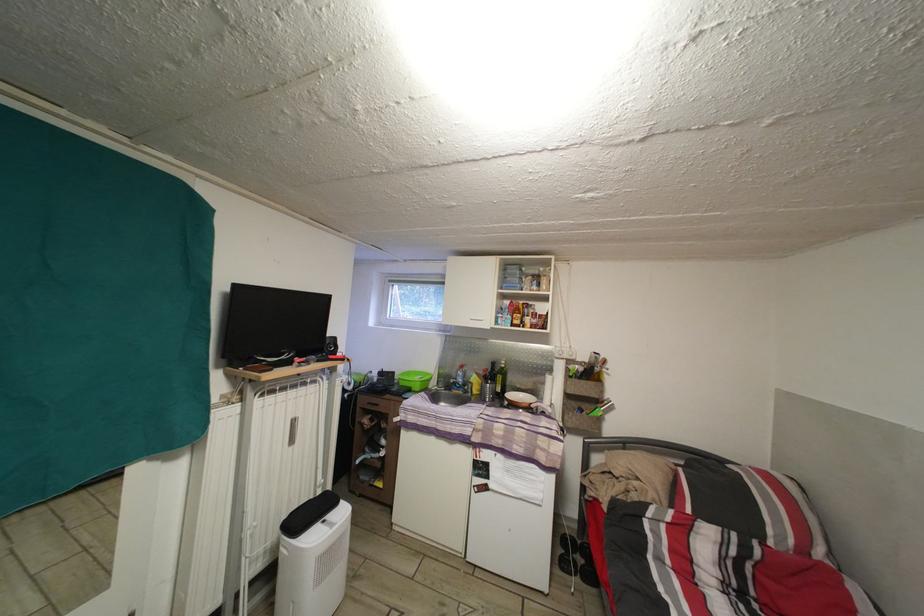
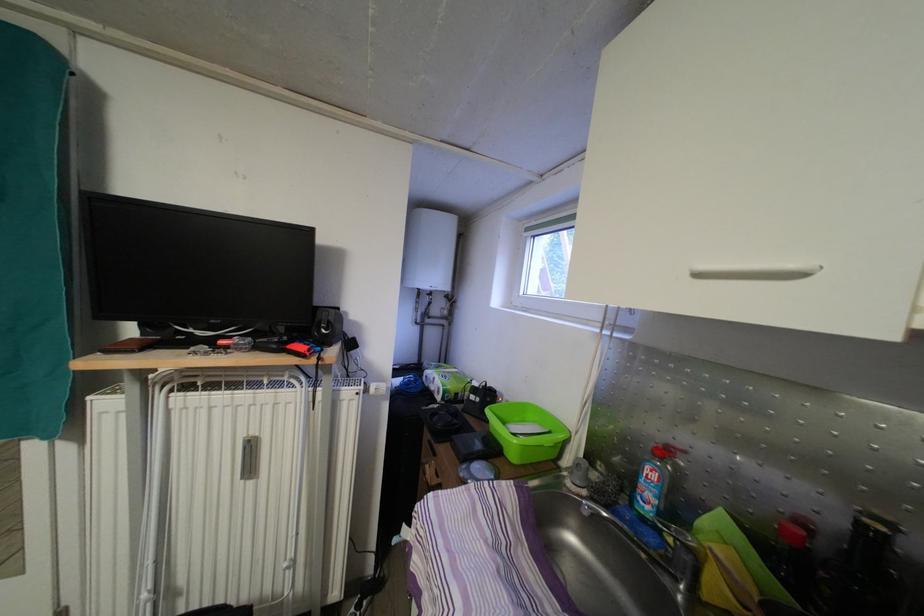
In the second image, find the point that corresponds to (x=367, y=385) in the first image.

(460, 394)